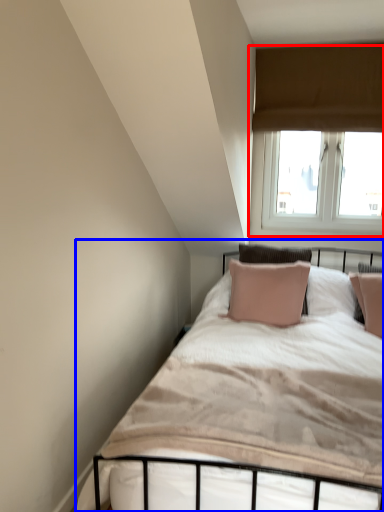
Question: Which of the following is the closest to the observer, window (highlighted by a red box) or bed (highlighted by a blue box)?

Choices:
 (A) window
 (B) bed

Answer: (B)